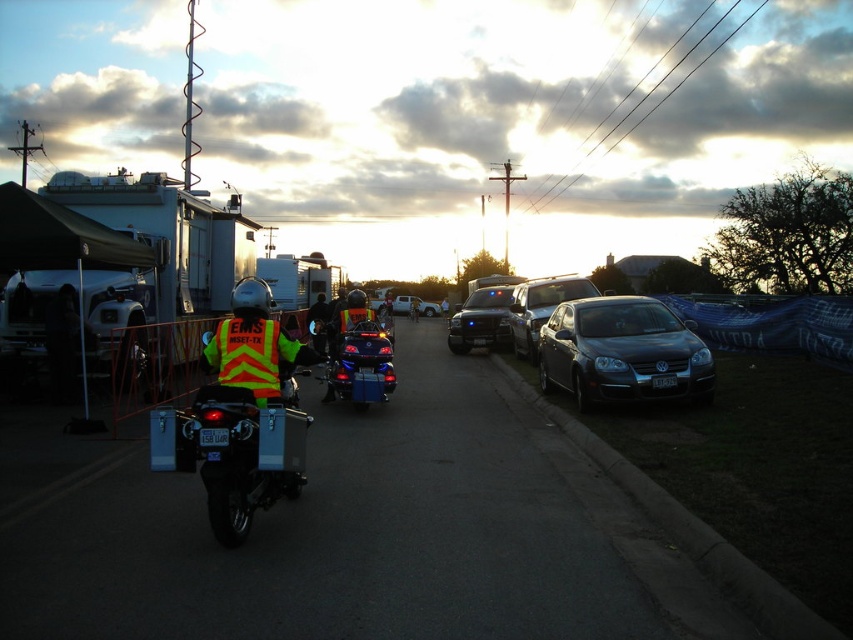
Question: Is metallic silver truck at left to the left of metallic blue truck at center from the viewer's perspective?

Choices:
 (A) yes
 (B) no

Answer: (A)

Question: Which point is farther from the camera taking this photo?

Choices:
 (A) coord(225,422)
 (B) coord(263,381)
 (C) coord(576,392)
 (D) coord(357,362)

Answer: (D)

Question: Does reflective yellow-green vest at center have a greater width compared to white glossy sedan at center?

Choices:
 (A) yes
 (B) no

Answer: (B)

Question: Which object is positioned closest to the white glossy sedan at center?

Choices:
 (A) reflective yellow vest at center
 (B) metallic blue truck at center
 (C) metallic silver truck at left

Answer: (B)

Question: Is the position of matte black sedan at center less distant than that of satin black sedan at center?

Choices:
 (A) no
 (B) yes

Answer: (B)

Question: Among these objects, which one is nearest to the camera?

Choices:
 (A) satin black sedan at center
 (B) reflective yellow-green vest at center
 (C) shiny blue motorcycle at center
 (D) reflective yellow safety vest at center

Answer: (B)